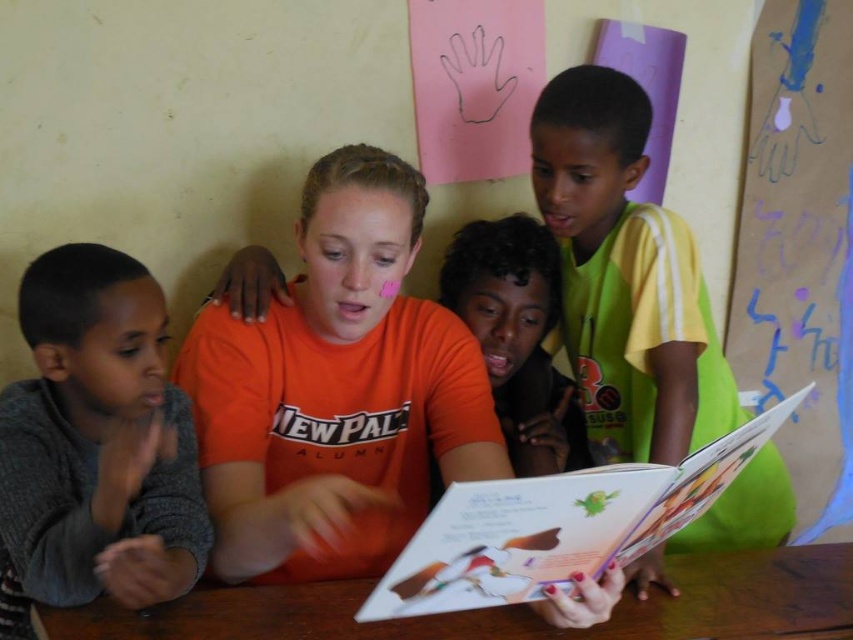
Describe the element at coordinates (625, 276) in the screenshot. This screenshot has width=853, height=640. I see `yellow jersey at right` at that location.

At what (x,y) coordinates should I click in order to perform the action: click on yellow jersey at right. Please return your answer as a coordinate pair (x, y). The width and height of the screenshot is (853, 640). Looking at the image, I should click on (625, 276).

The width and height of the screenshot is (853, 640). I want to click on yellow jersey at right, so click(625, 276).

Who is more forward, (271, 312) or (525, 616)?

Positioned in front is point (525, 616).

In the scene shown: Between orange matte shirt at center and wooden table at lower center, which one is positioned higher?

orange matte shirt at center

Is point (437, 452) positioned behind point (216, 621)?

Yes, it is behind point (216, 621).

I want to click on orange matte shirt at center, so click(x=335, y=390).

Which is below, wooden table at lower center or paperboard book at center?

Positioned lower is wooden table at lower center.

Can you confirm if wooden table at lower center is smaller than paperboard book at center?

Yes, wooden table at lower center is smaller than paperboard book at center.

Who is more distant from viewer, (666, 616) or (439, 522)?

The point (666, 616) is behind.

Identify the location of wooden table at lower center. The height and width of the screenshot is (640, 853). (509, 608).